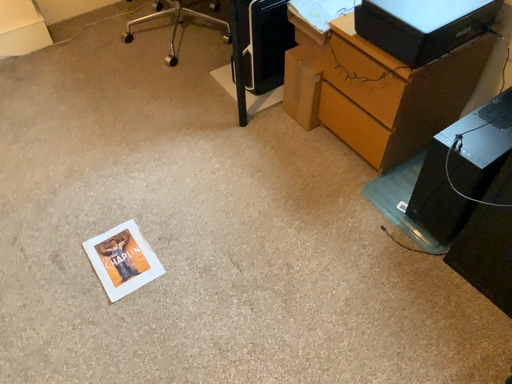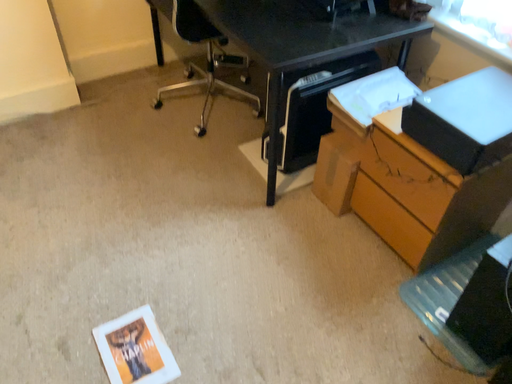
Question: Which way did the camera rotate in the video?

Choices:
 (A) rotated downward
 (B) rotated upward

Answer: (B)